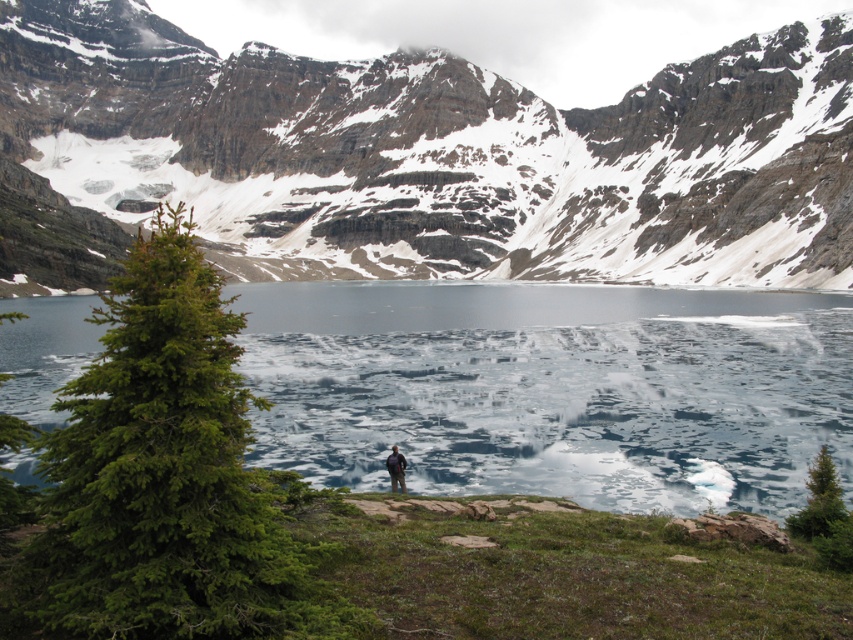
Is rocky gray mountain at upper center positioned behind dark blue fabric at center?

Yes, it is.

Does rocky gray mountain at upper center appear on the right side of dark blue fabric at center?

No, rocky gray mountain at upper center is not to the right of dark blue fabric at center.

Which is behind, point (99, 161) or point (389, 467)?

Point (99, 161)

You are a GUI agent. You are given a task and a screenshot of the screen. Output one action in this format:
    pyautogui.click(x=<x>, y=<y>)
    Task: Click on the rocky gray mountain at upper center
    
    Given the screenshot: What is the action you would take?
    pyautogui.click(x=442, y=154)

Does translucent ice at center come in front of dark blue fabric at center?

Yes, it is in front of dark blue fabric at center.

Between point (683, 513) and point (395, 481), which one is positioned in front?

Positioned in front is point (683, 513).

Who is more distant from viewer, (643, 387) or (401, 481)?

Positioned behind is point (643, 387).

Identify the location of translucent ice at center. The width and height of the screenshot is (853, 640). (553, 388).

Is green needle-like tree at left to the left of dark blue fabric at center from the viewer's perspective?

Yes, green needle-like tree at left is to the left of dark blue fabric at center.

Describe the element at coordinates (167, 477) in the screenshot. I see `green needle-like tree at left` at that location.

Does point (163, 598) come farther from viewer compared to point (397, 477)?

No, it is in front of (397, 477).

Where is `green needle-like tree at left`? green needle-like tree at left is located at coordinates (167, 477).